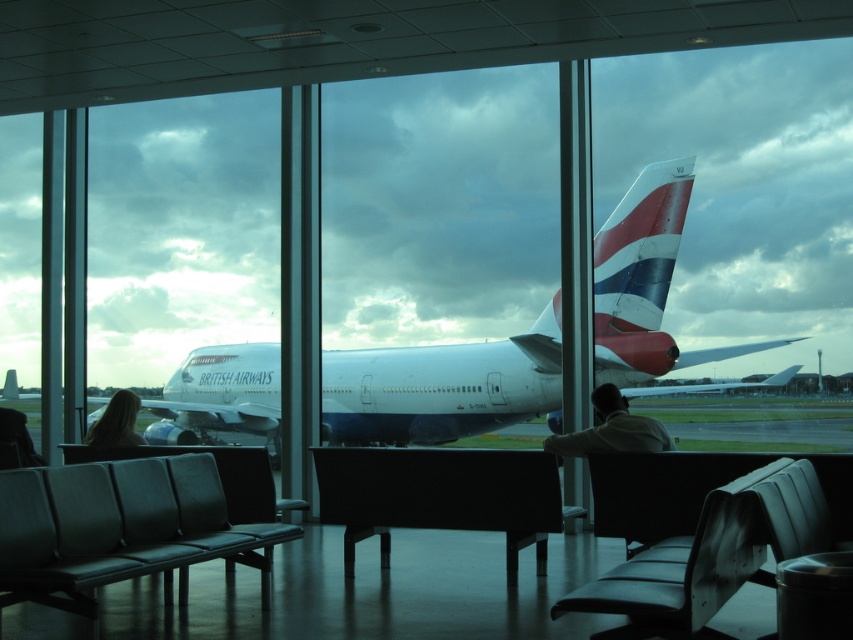
Question: Among these points, which one is farthest from the camera?

Choices:
 (A) (518, 456)
 (B) (781, 458)
 (C) (747, 504)

Answer: (A)

Question: Among these points, which one is nearest to the camera?

Choices:
 (A) (122, 401)
 (B) (561, 448)
 (C) (405, 470)
 (D) (711, 561)

Answer: (D)

Question: Does white glossy airplane at center appear under blonde hair at center?

Choices:
 (A) yes
 (B) no

Answer: (A)

Question: Is polished aluminum airplane tail at center closer to camera compared to black leather chair at center?

Choices:
 (A) yes
 (B) no

Answer: (B)

Question: Can you confirm if black fabric chair at center is positioned above white shirt at center?

Choices:
 (A) yes
 (B) no

Answer: (B)

Question: Which object appears closest to the camera in this image?

Choices:
 (A) metallic silver trash can at lower right
 (B) black leather chair at center
 (C) blonde hair at center
 (D) polished aluminum airplane tail at center

Answer: (A)